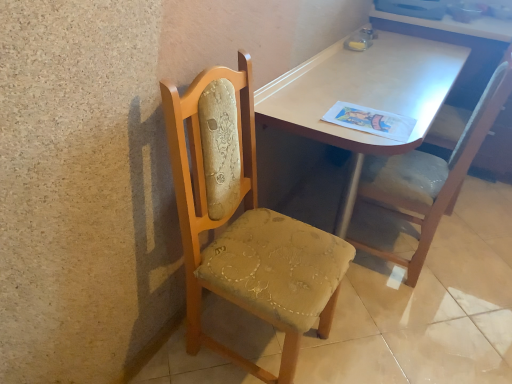
Question: Does velvet upholstered chair at right, the first chair viewed from the right, have a smaller size compared to light brown wood table at center?

Choices:
 (A) yes
 (B) no

Answer: (A)

Question: Is the depth of velvet upholstered chair at right, the first chair viewed from the right, greater than that of light brown wood table at center?

Choices:
 (A) no
 (B) yes

Answer: (B)

Question: Is velvet upholstered chair at right, the second chair when ordered from left to right, to the left of light brown wood table at center from the viewer's perspective?

Choices:
 (A) yes
 (B) no

Answer: (B)

Question: Can you confirm if velvet upholstered chair at right, the first chair viewed from the right, is positioned to the right of light brown wood table at center?

Choices:
 (A) yes
 (B) no

Answer: (A)

Question: Considering the relative sizes of velvet upholstered chair at right, the first chair viewed from the right, and light brown wood table at center in the image provided, is velvet upholstered chair at right, the first chair viewed from the right, taller than light brown wood table at center?

Choices:
 (A) no
 (B) yes

Answer: (B)

Question: Can you confirm if woodenchair at left, which is the second chair from right to left, is taller than wooden chair at left?

Choices:
 (A) no
 (B) yes

Answer: (B)

Question: From the image's perspective, is woodenchair at left, which is the second chair from right to left, on wooden chair at left?

Choices:
 (A) yes
 (B) no

Answer: (A)

Question: Considering the relative sizes of woodenchair at left, which is the second chair from right to left, and wooden chair at left in the image provided, is woodenchair at left, which is the second chair from right to left, bigger than wooden chair at left?

Choices:
 (A) yes
 (B) no

Answer: (B)

Question: Does woodenchair at left, the 1th chair viewed from the left, appear on the right side of wooden chair at left?

Choices:
 (A) yes
 (B) no

Answer: (B)

Question: From a real-world perspective, is woodenchair at left, which is the second chair from right to left, over wooden chair at left?

Choices:
 (A) no
 (B) yes

Answer: (B)

Question: Would you say woodenchair at left, the 1th chair viewed from the left, is outside wooden chair at left?

Choices:
 (A) no
 (B) yes

Answer: (B)

Question: Is light brown wood table at center smaller than wooden chair at left?

Choices:
 (A) yes
 (B) no

Answer: (B)